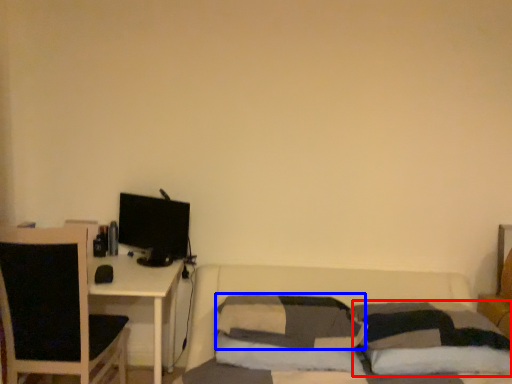
Question: Which object appears farthest to the camera in this image, pillow (highlighted by a red box) or pillow (highlighted by a blue box)?

Choices:
 (A) pillow
 (B) pillow

Answer: (B)